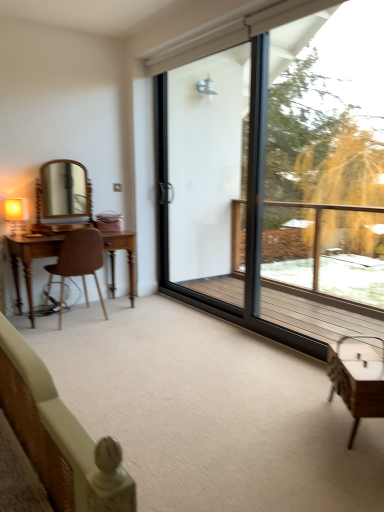
Question: Can you confirm if transparent glass window at center is smaller than matte gold table lamp at left?

Choices:
 (A) no
 (B) yes

Answer: (A)

Question: Can you confirm if transparent glass window at center is positioned to the right of matte gold table lamp at left?

Choices:
 (A) yes
 (B) no

Answer: (A)

Question: Is transparent glass window at center shorter than matte gold table lamp at left?

Choices:
 (A) no
 (B) yes

Answer: (A)

Question: From a real-world perspective, is transparent glass window at center physically below matte gold table lamp at left?

Choices:
 (A) yes
 (B) no

Answer: (B)

Question: From the image's perspective, does transparent glass window at center appear higher than matte gold table lamp at left?

Choices:
 (A) yes
 (B) no

Answer: (A)

Question: Is point (195, 124) positioned closer to the camera than point (347, 195)?

Choices:
 (A) farther
 (B) closer

Answer: (B)

Question: From the image's perspective, is transparent glass screen door at center above or below green leafy tree at right?

Choices:
 (A) above
 (B) below

Answer: (A)

Question: Which is correct: transparent glass screen door at center is inside green leafy tree at right, or outside of it?

Choices:
 (A) outside
 (B) inside

Answer: (A)

Question: In the image, is transparent glass screen door at center positioned in front of or behind green leafy tree at right?

Choices:
 (A) front
 (B) behind

Answer: (B)

Question: In the image, is brown leather chair at left on the left side or the right side of matte gold table lamp at left?

Choices:
 (A) left
 (B) right

Answer: (B)

Question: Considering the positions of brown leather chair at left and matte gold table lamp at left in the image, is brown leather chair at left taller or shorter than matte gold table lamp at left?

Choices:
 (A) tall
 (B) short

Answer: (A)

Question: From the image's perspective, is brown leather chair at left positioned above or below matte gold table lamp at left?

Choices:
 (A) below
 (B) above

Answer: (A)

Question: From a real-world perspective, is brown leather chair at left above or below matte gold table lamp at left?

Choices:
 (A) above
 (B) below

Answer: (B)

Question: Is transparent glass screen door at center to the left or to the right of matte gold table lamp at left in the image?

Choices:
 (A) right
 (B) left

Answer: (A)

Question: From the image's perspective, is transparent glass screen door at center above or below matte gold table lamp at left?

Choices:
 (A) above
 (B) below

Answer: (A)